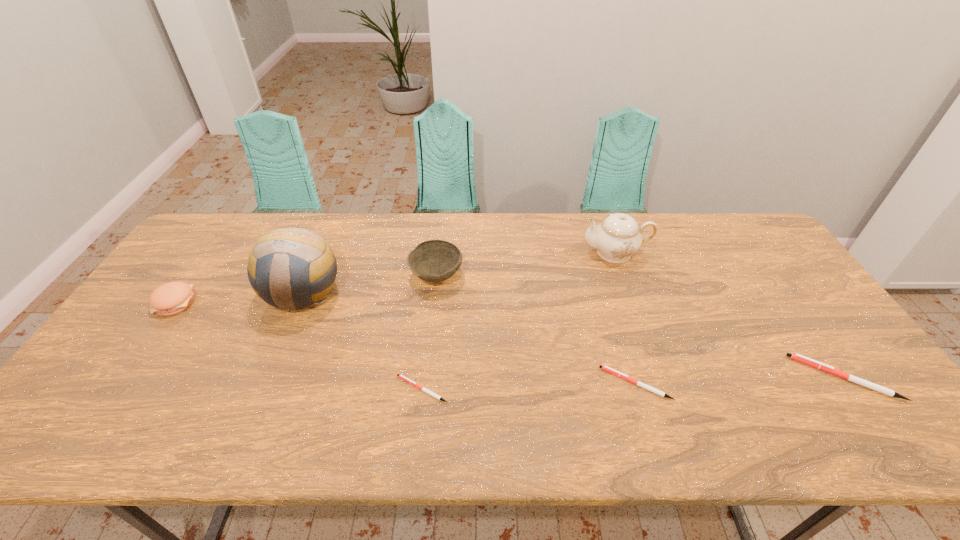
Find the location of a particular element. This screenshot has width=960, height=540. object present at the near right corner is located at coordinates (797, 357).

Locate an element on the screen. This screenshot has height=540, width=960. free space at the far edge of the desktop is located at coordinates (357, 234).

Where is `vacant space at the near edge`? This screenshot has width=960, height=540. vacant space at the near edge is located at coordinates (544, 382).

In the image, there is a desktop. At what (x,y) coordinates should I click in order to perform the action: click on free space at the left edge. Please return your answer as a coordinate pair (x, y). This screenshot has height=540, width=960. Looking at the image, I should click on (124, 368).

At what (x,y) coordinates should I click in order to perform the action: click on vacant region at the far right corner of the desktop. Please return your answer as a coordinate pair (x, y). Looking at the image, I should click on (732, 234).

This screenshot has height=540, width=960. In order to click on empty space that is in between the shortest pen and the sixth shortest object in this screenshot , I will do `click(518, 321)`.

You are a GUI agent. You are given a task and a screenshot of the screen. Output one action in this format:
    pyautogui.click(x=<x>, y=<y>)
    Task: Click on the free spot between the rightmost object and the second shortest pen
    This screenshot has height=540, width=960.
    Given the screenshot: What is the action you would take?
    pyautogui.click(x=740, y=381)

In order to click on free space between the leftmost pen and the fourth shortest object in this screenshot , I will do (x=299, y=346).

Locate an element on the screen. Image resolution: width=960 pixels, height=540 pixels. vacant space in between the second pen from left to right and the fifth tallest object is located at coordinates [x=740, y=381].

Locate an element on the screen. The height and width of the screenshot is (540, 960). free space between the sixth tallest object and the leftmost pen is located at coordinates coord(529,386).